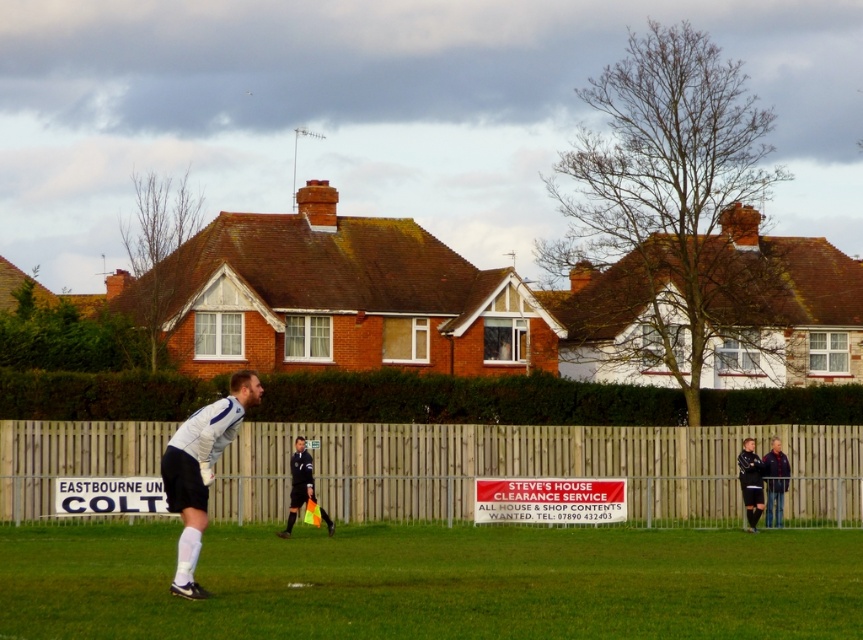
Question: Is wooden fence at center bigger than white matte jersey at center?

Choices:
 (A) yes
 (B) no

Answer: (B)

Question: Considering the real-world distances, which object is closest to the black jersey at right?

Choices:
 (A) dark blue jersey at center
 (B) neon yellow fabric flag at center

Answer: (A)

Question: Which object is the farthest from the green grass at center?

Choices:
 (A) white matte jersey at center
 (B) dark blue jersey at center

Answer: (B)

Question: Is white matte jersey at center above black jersey at right?

Choices:
 (A) yes
 (B) no

Answer: (A)

Question: Which of the following is the closest to the observer?

Choices:
 (A) green grass at center
 (B) black jersey at right
 (C) neon yellow fabric flag at center
 (D) white matte jersey at center

Answer: (A)

Question: Can you confirm if green grass at center is smaller than white matte jersey at center?

Choices:
 (A) no
 (B) yes

Answer: (A)